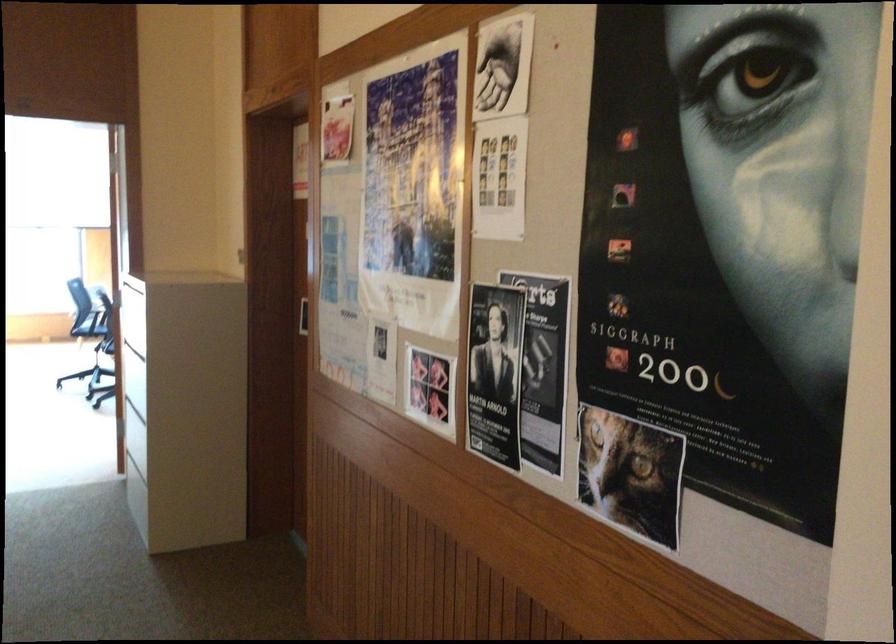
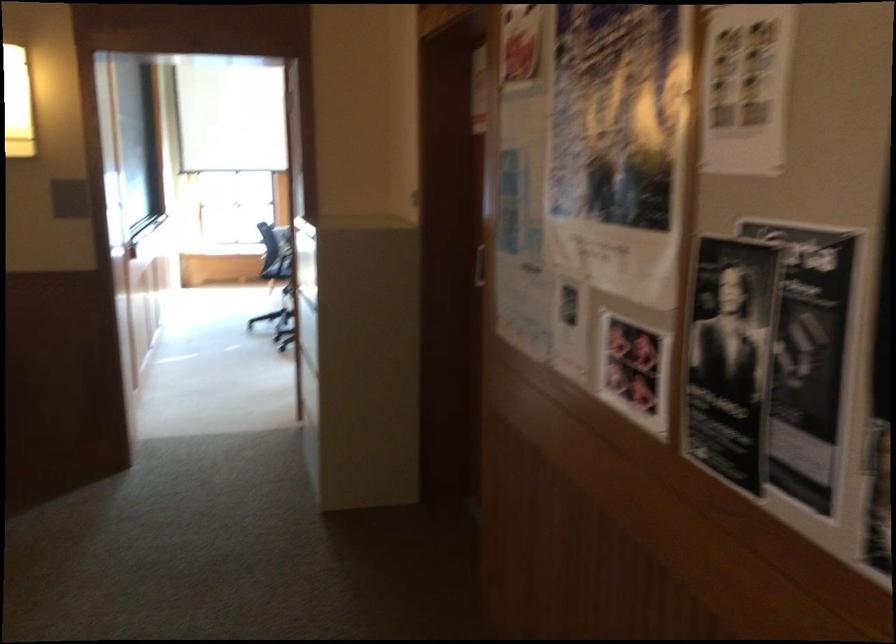
Question: What movement of the cameraman would produce the second image?

Choices:
 (A) Left
 (B) Right
 (C) Forward
 (D) Backward

Answer: (C)